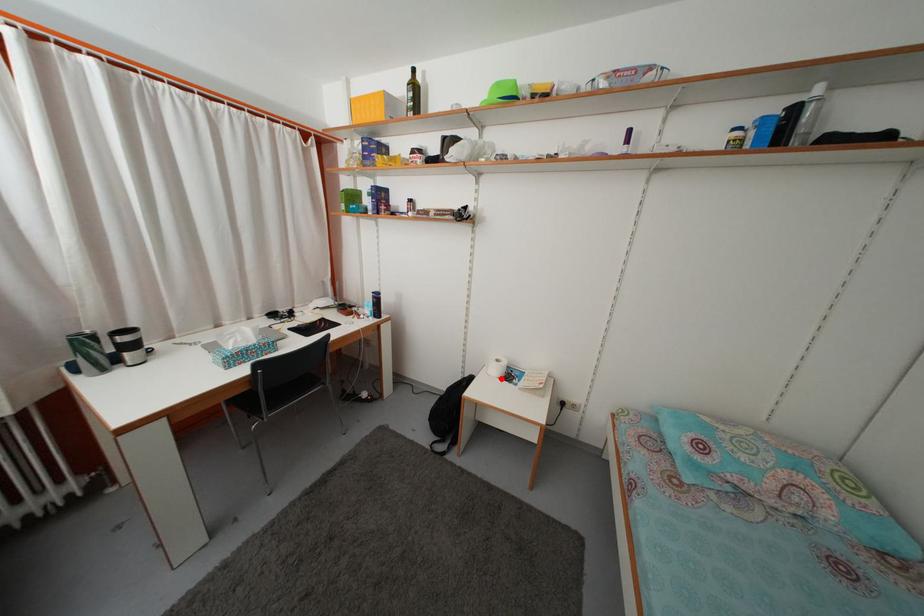
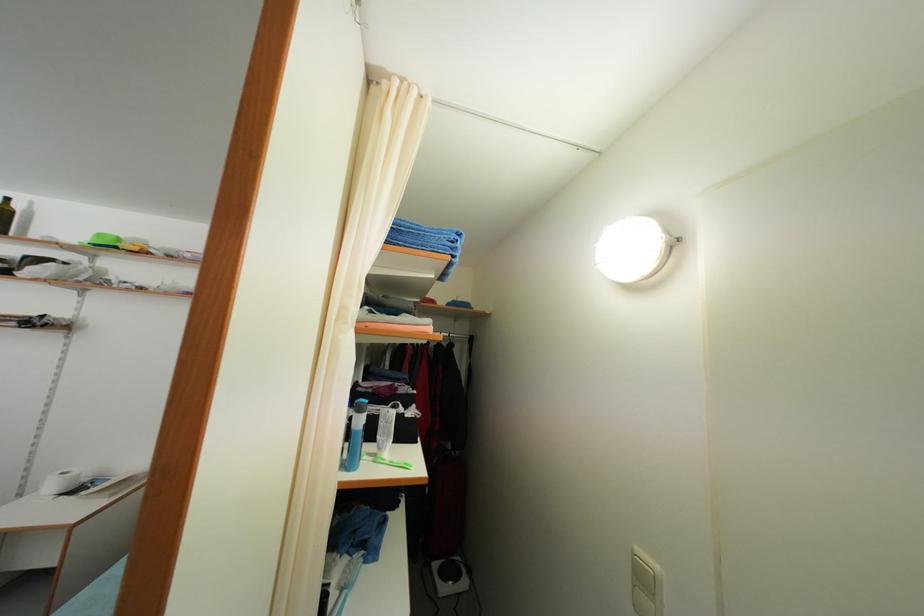
Question: I am providing you with two images of the same scene from different viewpoints. In image1, a red point is highlighted. Considering the same 3D point in image2, which of the following is correct?

Choices:
 (A) It is closer
 (B) It is farther

Answer: (A)